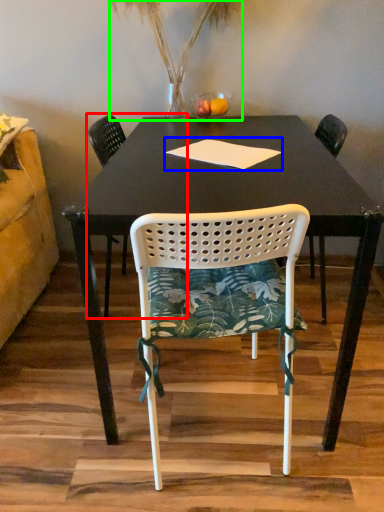
Question: Based on their relative distances, which object is farther from chair (highlighted by a red box)? Choose from notepad (highlighted by a blue box) and plant (highlighted by a green box).

Choices:
 (A) notepad
 (B) plant

Answer: (A)